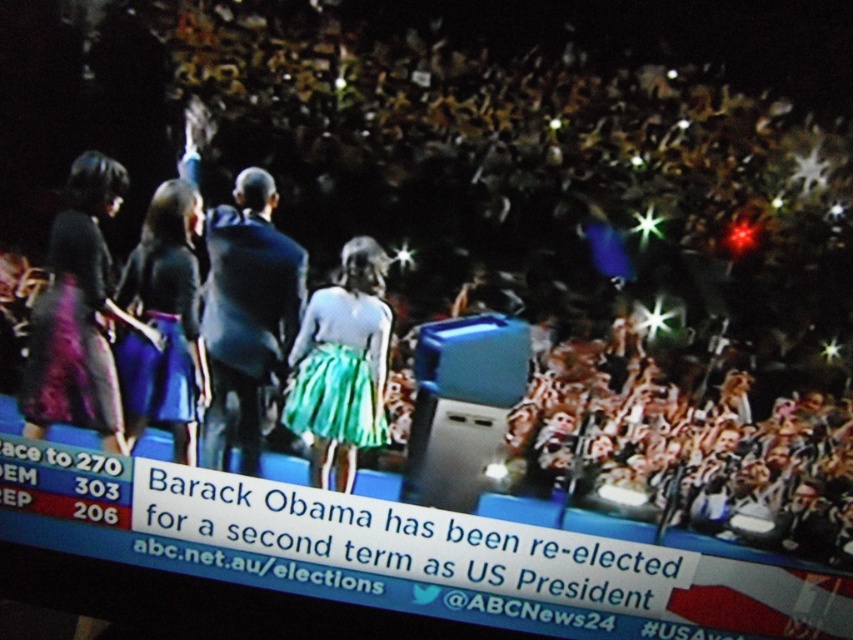
Does matte purple skirt at left appear on the left side of matte black dress at left?

Correct, you'll find matte purple skirt at left to the left of matte black dress at left.

Describe the element at coordinates (79, 314) in the screenshot. I see `matte purple skirt at left` at that location.

The height and width of the screenshot is (640, 853). What do you see at coordinates (79, 314) in the screenshot?
I see `matte purple skirt at left` at bounding box center [79, 314].

Identify the location of matte purple skirt at left. (79, 314).

Can you confirm if dark blue suit at center is shorter than matte purple skirt at left?

In fact, dark blue suit at center may be taller than matte purple skirt at left.

Is point (244, 468) in front of point (84, 397)?

No, (244, 468) is further to viewer.

Which is in front, point (225, 253) or point (109, 284)?

Point (225, 253) is in front.

The height and width of the screenshot is (640, 853). In order to click on dark blue suit at center in this screenshot , I will do [247, 314].

Who is taller, dark blue suit at center or teal satin skirt at center?

dark blue suit at center is taller.

Does dark blue suit at center have a smaller size compared to teal satin skirt at center?

Incorrect, dark blue suit at center is not smaller in size than teal satin skirt at center.

Does point (263, 227) come behind point (380, 438)?

No, it is not.

The height and width of the screenshot is (640, 853). I want to click on dark blue suit at center, so click(x=247, y=314).